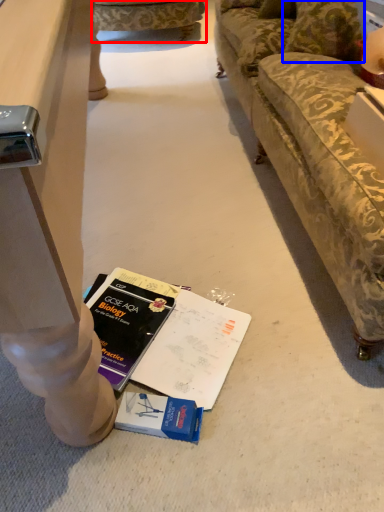
Question: Which point is further to the camera, studio couch (highlighted by a red box) or pillow (highlighted by a blue box)?

Choices:
 (A) studio couch
 (B) pillow

Answer: (A)